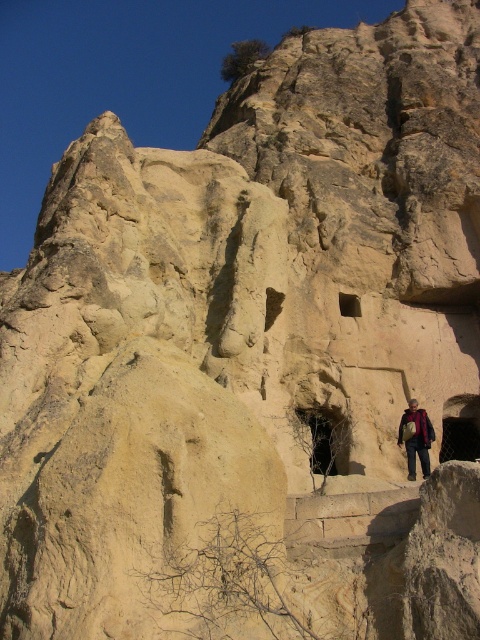
Question: Which point is farther from the camera taking this photo?

Choices:
 (A) (406, 413)
 (B) (425, 477)

Answer: (A)

Question: Which point is farther to the camera?

Choices:
 (A) (419, 440)
 (B) (416, 417)

Answer: (B)

Question: Is dark brown leather jacket at lower center to the left of brown textured jacket at lower right from the viewer's perspective?

Choices:
 (A) yes
 (B) no

Answer: (B)

Question: Is dark brown leather jacket at lower center smaller than brown textured jacket at lower right?

Choices:
 (A) no
 (B) yes

Answer: (A)

Question: Is dark brown leather jacket at lower center to the right of brown textured jacket at lower right from the viewer's perspective?

Choices:
 (A) no
 (B) yes

Answer: (B)